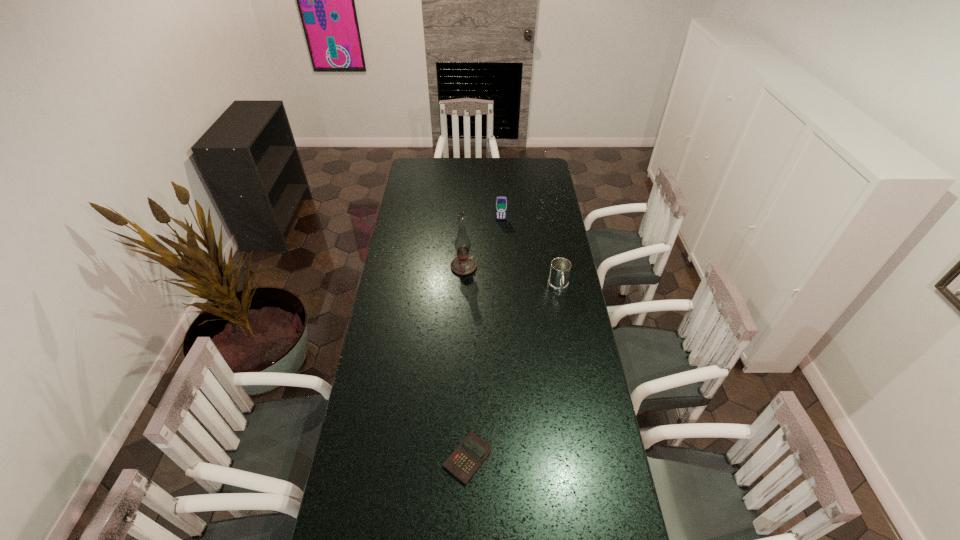
Identify the location of free space located 0.210m on the side of the rightmost object with the handle. This screenshot has height=540, width=960. (567, 338).

Locate an element on the screen. The height and width of the screenshot is (540, 960). vacant space located on the right of the nearest object is located at coordinates (535, 458).

The image size is (960, 540). In order to click on object that is at the right edge in this screenshot , I will do `click(560, 268)`.

Where is `free region at the left edge`? The height and width of the screenshot is (540, 960). free region at the left edge is located at coordinates (379, 500).

You are a GUI agent. You are given a task and a screenshot of the screen. Output one action in this format:
    pyautogui.click(x=<x>, y=<y>)
    Task: Click on the vacant space at the right edge
    
    Given the screenshot: What is the action you would take?
    pyautogui.click(x=582, y=398)

At what (x,y) coordinates should I click in order to perform the action: click on vacant space at the far left corner. Please return your answer as a coordinate pair (x, y). This screenshot has height=540, width=960. Looking at the image, I should click on (413, 168).

The image size is (960, 540). Find the location of `free space between the second nearest object and the shortest object`. free space between the second nearest object and the shortest object is located at coordinates (513, 373).

Identify the location of empty location between the farthest object and the nearest object. (484, 339).

Where is `free space between the third object from left to right and the third nearest object`? The width and height of the screenshot is (960, 540). free space between the third object from left to right and the third nearest object is located at coordinates (482, 244).

You are a GUI agent. You are given a task and a screenshot of the screen. Output one action in this format:
    pyautogui.click(x=<x>, y=<y>)
    Task: Click on the empty space between the third farthest object and the tallest object
    
    Given the screenshot: What is the action you would take?
    pyautogui.click(x=511, y=278)